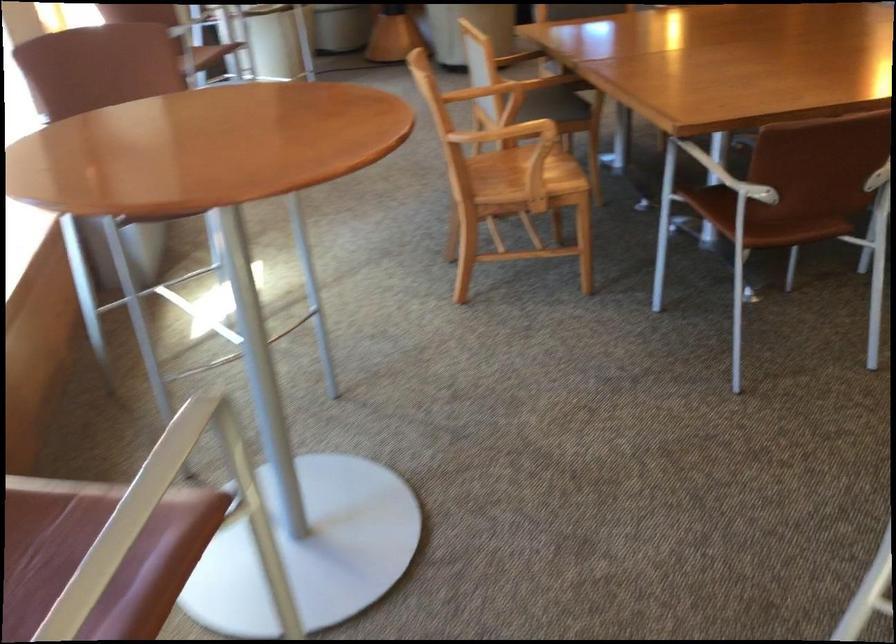
You are a GUI agent. You are given a task and a screenshot of the screen. Output one action in this format:
    pyautogui.click(x=<x>, y=<y>)
    Task: Click on the wooden chair sitting surface
    This screenshot has height=644, width=896.
    Given the screenshot: What is the action you would take?
    pyautogui.click(x=528, y=178)